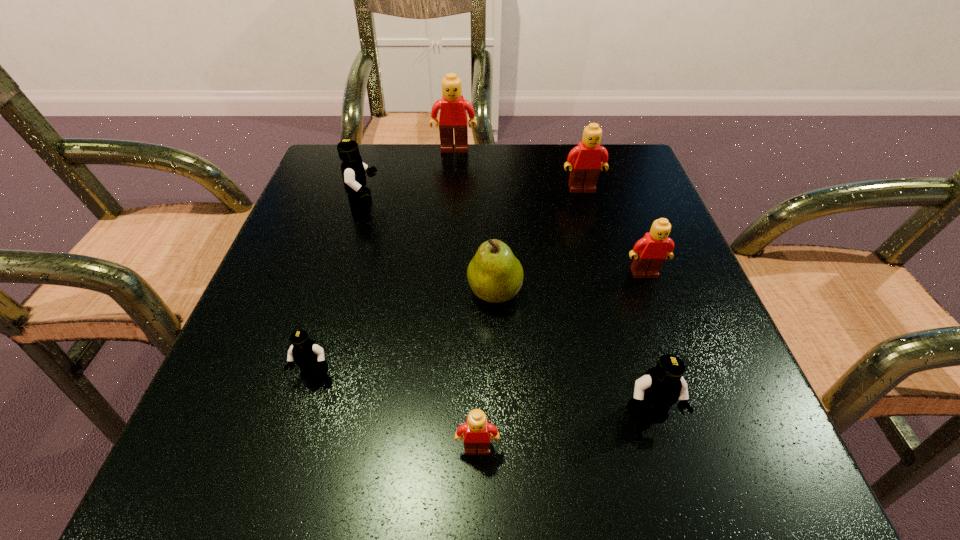
This screenshot has height=540, width=960. In order to click on Lego that is the third nearest to the tallest object in this screenshot , I will do `click(650, 252)`.

Select which Lego is the fourth closest to the third farthest brown Lego. Please provide its 2D coordinates. Your answer should be formatted as a tuple, i.e. [(x, y)], where the tuple contains the x and y coordinates of a point satisfying the conditions above.

[(452, 106)]

Select which brown Lego is the third closest to the nearest brown Lego. Please provide its 2D coordinates. Your answer should be formatted as a tuple, i.e. [(x, y)], where the tuple contains the x and y coordinates of a point satisfying the conditions above.

[(452, 106)]

The width and height of the screenshot is (960, 540). Find the location of `the third closest brown Lego to the third biggest brown Lego`. the third closest brown Lego to the third biggest brown Lego is located at coordinates [x=452, y=106].

Identify which black Lego is the second nearest to the nearest black Lego. Please provide its 2D coordinates. Your answer should be formatted as a tuple, i.e. [(x, y)], where the tuple contains the x and y coordinates of a point satisfying the conditions above.

[(353, 169)]

The height and width of the screenshot is (540, 960). In order to click on black Lego that stands as the third closest to the third nearest brown Lego in this screenshot , I will do `click(309, 357)`.

Identify the location of vacant region that satisfies the following two spatial constraints: 1. on the face of the second biggest brown Lego; 2. on the front-facing side of the biggest black Lego. (587, 206).

Identify the location of free space that satisfies the following two spatial constraints: 1. on the front-facing side of the farthest black Lego; 2. on the front-facing side of the third nearest Lego. The height and width of the screenshot is (540, 960). (315, 374).

Identify the location of vacant space that satisfies the following two spatial constraints: 1. on the front-facing side of the farthest black Lego; 2. on the left side of the pear. This screenshot has height=540, width=960. (340, 293).